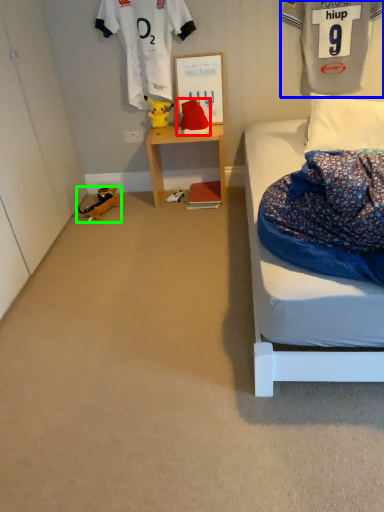
Question: Based on their relative distances, which object is farther from toy (highlighted by a red box)? Choose from clothing (highlighted by a blue box) and toy (highlighted by a green box).

Choices:
 (A) clothing
 (B) toy

Answer: (A)